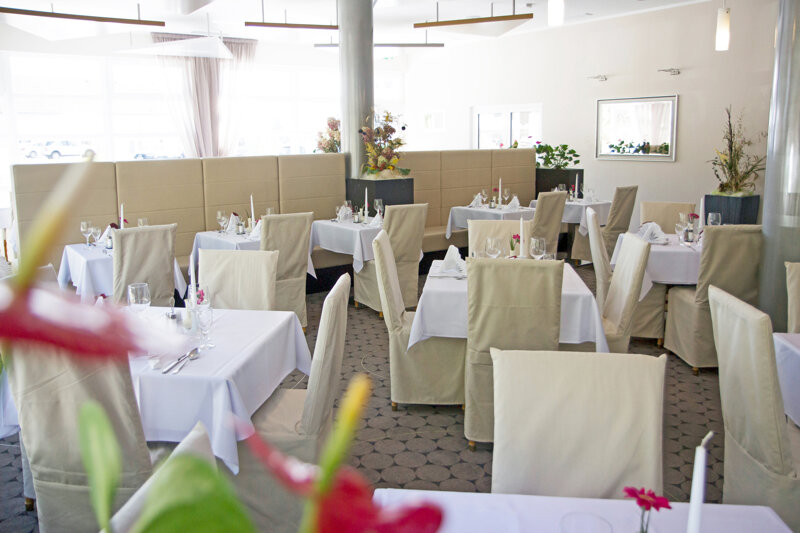
The height and width of the screenshot is (533, 800). Find the location of `hanging lights`. hanging lights is located at coordinates (501, 24), (418, 48), (308, 26), (74, 28), (120, 29), (190, 44).